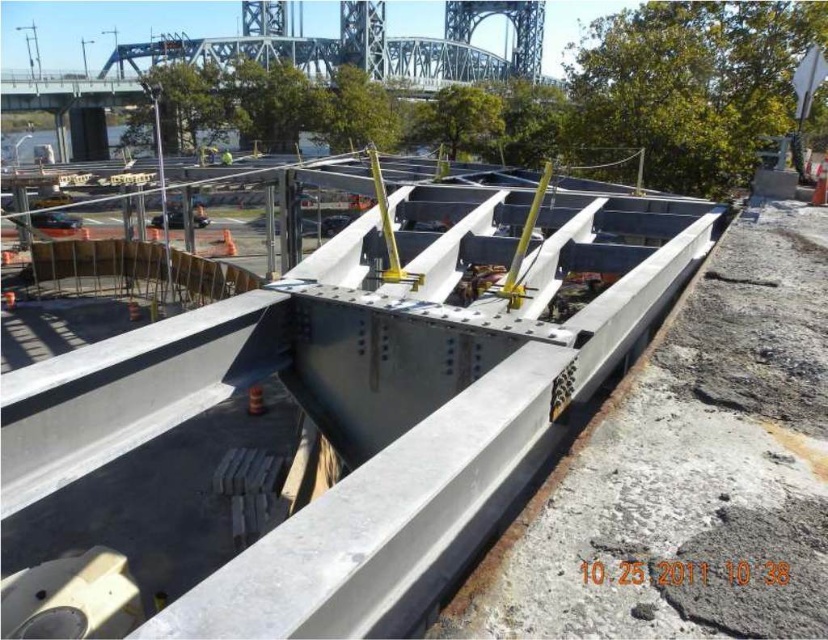
Does gray metallic beam at center have a larger size compared to yellow fabric construction worker at center?

Actually, gray metallic beam at center might be smaller than yellow fabric construction worker at center.

Which of these two, gray metallic beam at center or yellow fabric construction worker at center, stands shorter?

gray metallic beam at center

Who is more forward, (773, 540) or (220, 161)?

Point (773, 540) is in front.

Where is `gray metallic beam at center`? This screenshot has height=640, width=828. gray metallic beam at center is located at coordinates (689, 468).